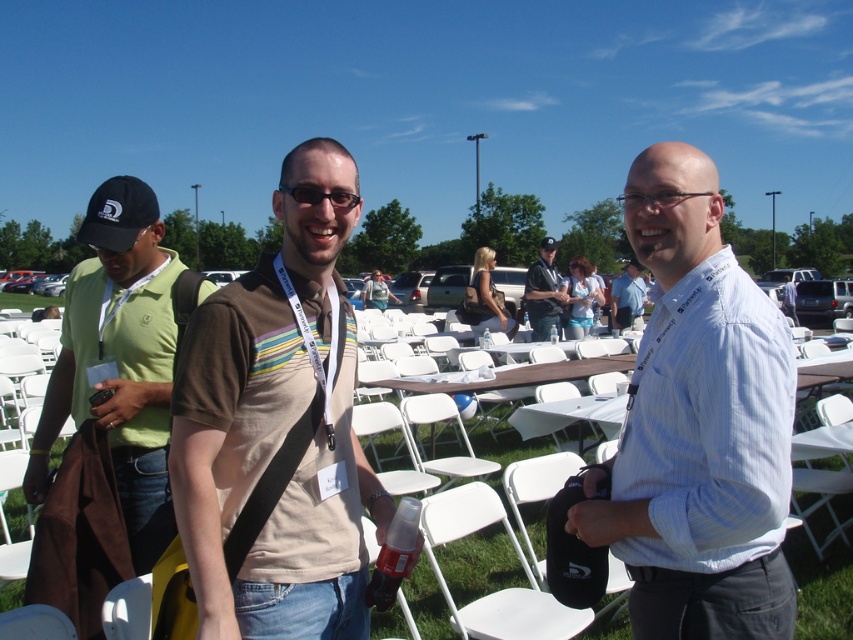
You are standing at the entrance of the event and want to find the white plastic chair at lower center. According to the coordinates provided, can you determine its position relative to the center of the image?

The white plastic chair at lower center is located at coordinates point (498,589). Since the coordinates are based on a scale from 0 to 1, the x value of 0.922 indicates it is near the right edge of the image, and the y value of 0.586 places it below the center vertically. Therefore, the chair is positioned towards the lower right quadrant of the image.

You are attending an outdoor event and want to find the person in the white striped shirt at center. Where would you look relative to the matte black shirt at center?

The white striped shirt at center is positioned under the matte black shirt at center, so you should look below the matte black shirt at center to find the white striped shirt at center.